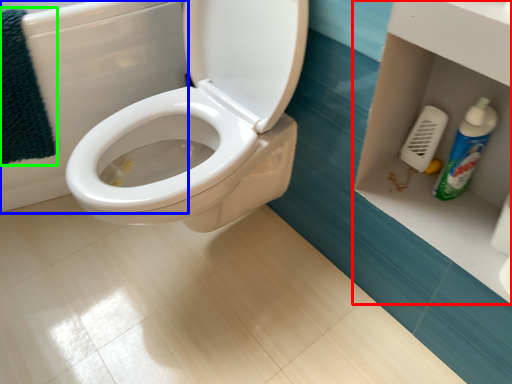
Question: Which object is the closest to the shelf (highlighted by a red box)? Choose among these: bath (highlighted by a blue box) or bath towel (highlighted by a green box).

Choices:
 (A) bath
 (B) bath towel

Answer: (A)